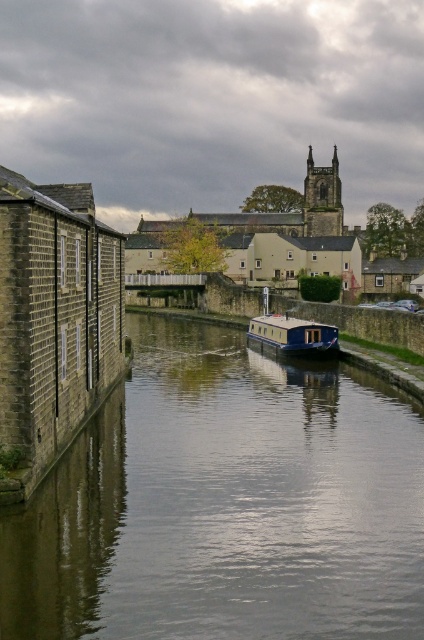
Question: Does smooth concrete canal at center come behind blue glossy houseboat at center?

Choices:
 (A) no
 (B) yes

Answer: (A)

Question: Does smooth concrete canal at center have a greater width compared to blue glossy houseboat at center?

Choices:
 (A) no
 (B) yes

Answer: (B)

Question: Which object is closer to the camera taking this photo?

Choices:
 (A) smooth concrete canal at center
 (B) blue glossy houseboat at center

Answer: (A)

Question: Which point is farther from the camera taking this photo?

Choices:
 (A) (278, 552)
 (B) (328, 336)

Answer: (B)

Question: Is smooth concrete canal at center to the left of blue glossy houseboat at center from the viewer's perspective?

Choices:
 (A) no
 (B) yes

Answer: (B)

Question: Which point is farther to the camera?

Choices:
 (A) [323, 344]
 (B) [332, 456]

Answer: (A)